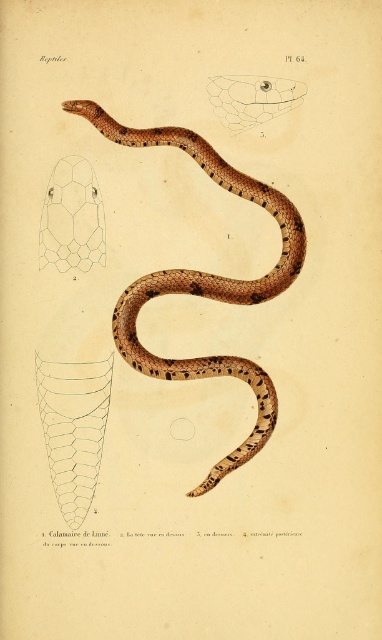
Question: Among these points, which one is farthest from the camera?

Choices:
 (A) (x=267, y=408)
 (B) (x=58, y=253)

Answer: (B)

Question: Observing the image, what is the correct spatial positioning of brown scaly snake at center in reference to translucent hexagonal pattern at upper left?

Choices:
 (A) right
 (B) left

Answer: (A)

Question: Is brown scaly snake at center above translucent hexagonal pattern at upper left?

Choices:
 (A) yes
 (B) no

Answer: (B)

Question: Does brown scaly snake at center have a lesser width compared to translucent hexagonal pattern at upper left?

Choices:
 (A) no
 (B) yes

Answer: (A)